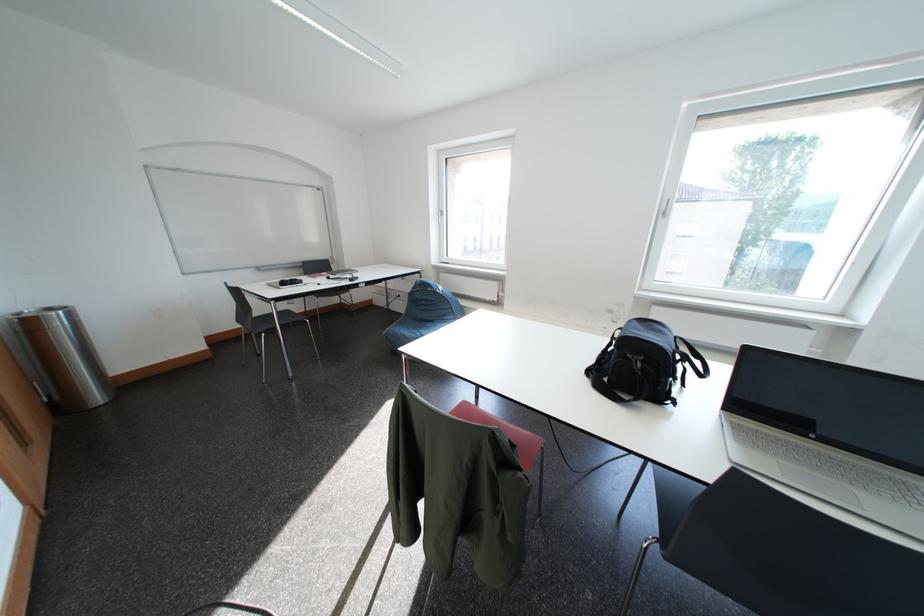
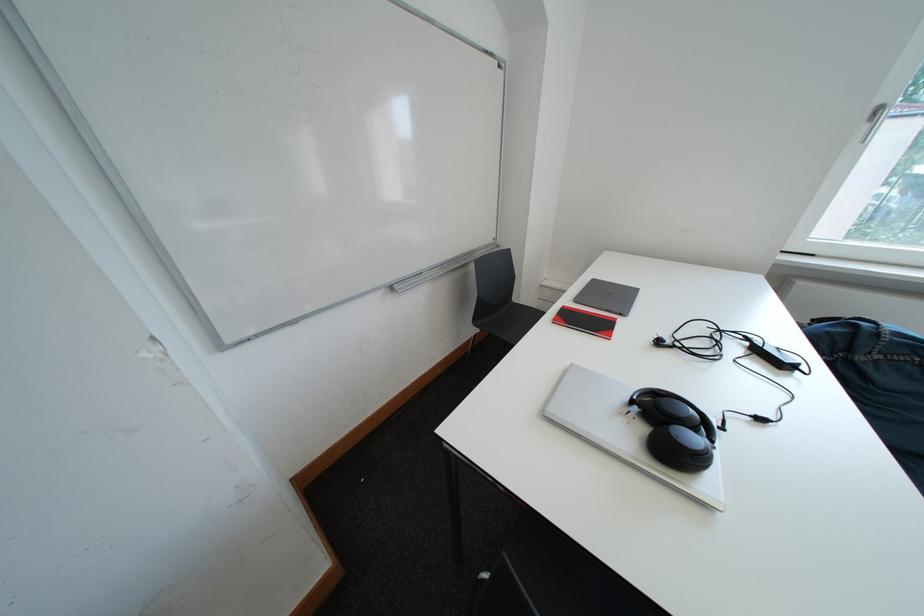
Find the pixel in the second image that matches point (270, 272) in the first image.

(403, 292)